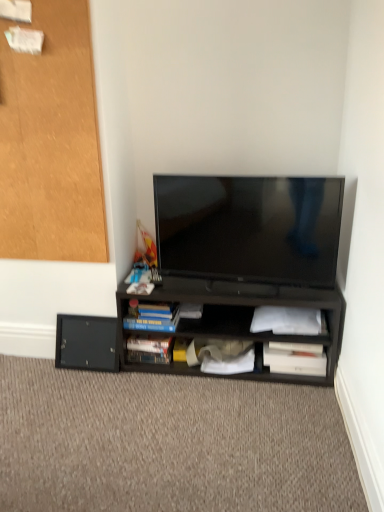
Question: Considering the relative sizes of black matte drawer at lower left and carpet at lower center in the image provided, is black matte drawer at lower left wider than carpet at lower center?

Choices:
 (A) no
 (B) yes

Answer: (A)

Question: Is black matte drawer at lower left facing away from carpet at lower center?

Choices:
 (A) yes
 (B) no

Answer: (B)

Question: Is carpet at lower center inside black matte drawer at lower left?

Choices:
 (A) no
 (B) yes

Answer: (A)

Question: Considering the relative sizes of black matte drawer at lower left and carpet at lower center in the image provided, is black matte drawer at lower left smaller than carpet at lower center?

Choices:
 (A) yes
 (B) no

Answer: (A)

Question: From a real-world perspective, is black matte drawer at lower left positioned over carpet at lower center based on gravity?

Choices:
 (A) yes
 (B) no

Answer: (A)

Question: From the image's perspective, relative to black matte cabinet at upper left, is hardcover book at lower center, which ranks as the 4th paperback book in right-to-left order, above or below?

Choices:
 (A) below
 (B) above

Answer: (A)

Question: Considering their positions, is hardcover book at lower center, which is counted as the first paperback book, starting from the left, located in front of or behind black matte cabinet at upper left?

Choices:
 (A) front
 (B) behind

Answer: (B)

Question: Is hardcover book at lower center, which ranks as the 4th paperback book in right-to-left order, spatially inside black matte cabinet at upper left, or outside of it?

Choices:
 (A) outside
 (B) inside

Answer: (A)

Question: Considering the positions of hardcover book at lower center, which ranks as the 4th paperback book in right-to-left order, and black matte cabinet at upper left in the image, is hardcover book at lower center, which ranks as the 4th paperback book in right-to-left order, wider or thinner than black matte cabinet at upper left?

Choices:
 (A) thin
 (B) wide

Answer: (B)

Question: In terms of width, does white paper at lower right, acting as the 4th paperback book starting from the left, look wider or thinner when compared to black matte cabinet at upper left?

Choices:
 (A) thin
 (B) wide

Answer: (B)

Question: Would you say white paper at lower right, acting as the 4th paperback book starting from the left, is to the left or to the right of black matte cabinet at upper left in the picture?

Choices:
 (A) right
 (B) left

Answer: (A)

Question: In terms of size, does white paper at lower right, acting as the 4th paperback book starting from the left, appear bigger or smaller than black matte cabinet at upper left?

Choices:
 (A) small
 (B) big

Answer: (A)

Question: From the image's perspective, is white paper at lower right, which is the first paperback book in right-to-left order, positioned above or below black matte cabinet at upper left?

Choices:
 (A) above
 (B) below

Answer: (B)

Question: In the image, is white matte paper at lower right, the 2th paperback book positioned from the right, positioned in front of or behind hardcover book at lower center, which is counted as the first paperback book, starting from the left?

Choices:
 (A) front
 (B) behind

Answer: (A)

Question: From the image's perspective, relative to hardcover book at lower center, which ranks as the 4th paperback book in right-to-left order, is white matte paper at lower right, the 2th paperback book positioned from the right, above or below?

Choices:
 (A) below
 (B) above

Answer: (B)